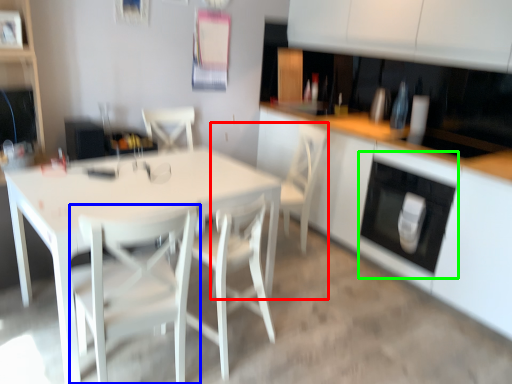
Question: Which is farther away from armchair (highlighted by a red box)? chair (highlighted by a blue box) or oven (highlighted by a green box)?

Choices:
 (A) chair
 (B) oven

Answer: (A)